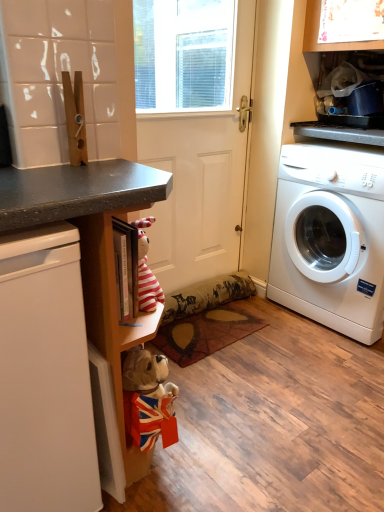
Find the location of a particular element. Image resolution: width=384 pixels, height=512 pixels. free region under patterned fabric mat at center (from a real-world perspective) is located at coordinates (213, 330).